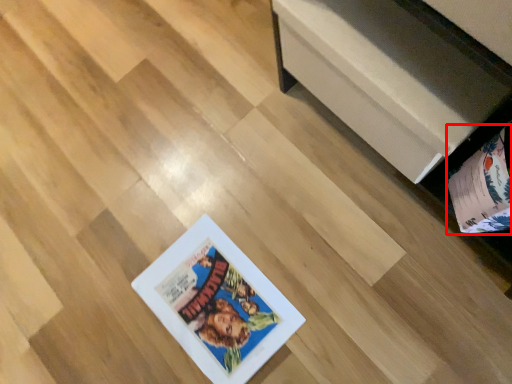
Question: From the image's perspective, where is album (annotated by the red box) located in relation to furniture in the image?

Choices:
 (A) above
 (B) below

Answer: (B)